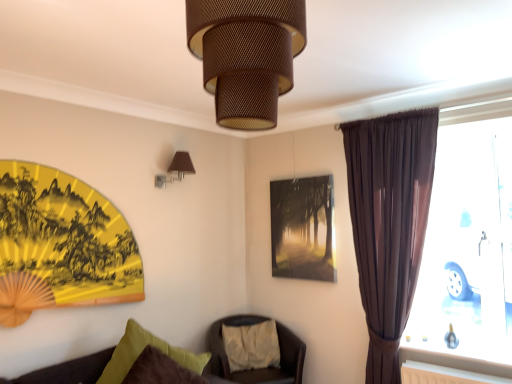
Question: Does point (413, 327) appear closer or farther from the camera than point (222, 339)?

Choices:
 (A) closer
 (B) farther

Answer: (A)

Question: In terms of height, does satin brown curtain at right look taller or shorter compared to brown leather chair at center?

Choices:
 (A) tall
 (B) short

Answer: (A)

Question: Estimate the real-world distances between objects in this image. Which object is closer to the brown leather chair at center?

Choices:
 (A) matte brown lampshade at upper left, the 2th lamp positioned from the right
 (B) matte glass picture frame at center
 (C) satin brown curtain at right
 (D) brown textured lampshade at upper center, the first lamp when ordered from front to back
 (E) velvet green pillow at lower left, positioned as the 2th pillow in back-to-front order

Answer: (B)

Question: Considering the real-world distances, which object is farthest from the brown leather chair at center?

Choices:
 (A) brown textured lampshade at upper center, the 2th lamp positioned from the back
 (B) white cotton pillow at center, marked as the 1th pillow in a right-to-left arrangement
 (C) satin brown curtain at right
 (D) matte brown lampshade at upper left, which is counted as the second lamp, starting from the front
 (E) velvet green pillow at lower left, positioned as the 2th pillow in back-to-front order

Answer: (A)